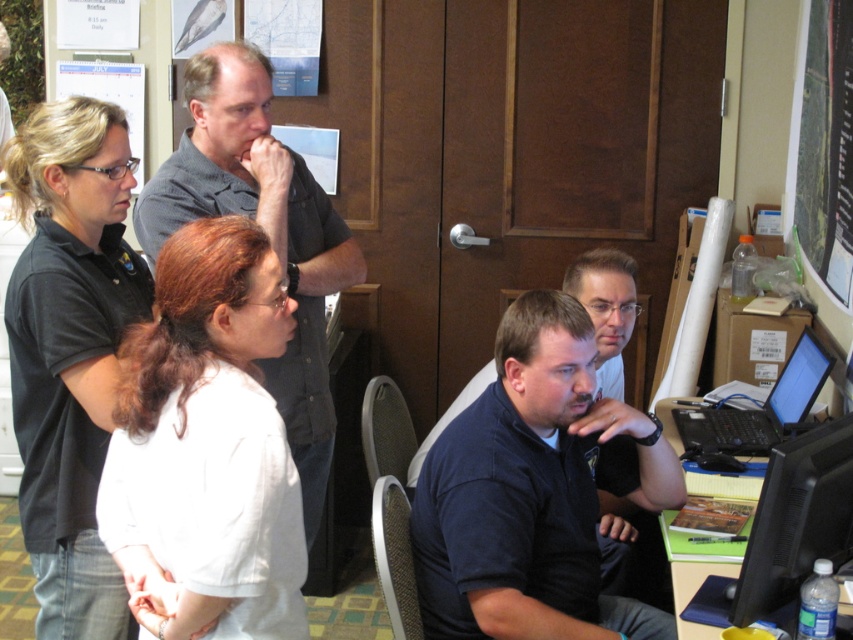
You are a photographer setting up a shot of the scene described. You need to position a spotlight so it can illuminate both the white matte shirt at left and the black shirt at upper left without overlapping their light areas. Based on their positions, which shirt should you aim the spotlight closer to?

The white matte shirt at left might be wider than black shirt at upper left, so you should aim the spotlight closer to the white matte shirt at left to ensure both areas are illuminated without overlapping.

You are a new employee entering the office and see the white matte shirt at left and the black shirt at upper left. Which employee is closer to the entrance?

The white matte shirt at left is positioned under the black shirt at upper left, so the white matte shirt at left is closer to the entrance.